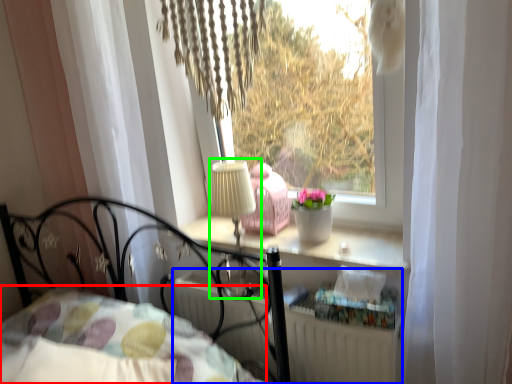
Question: Which is farther away from bedding (highlighted by a red box)? radiator (highlighted by a blue box) or table lamp (highlighted by a green box)?

Choices:
 (A) radiator
 (B) table lamp

Answer: (B)